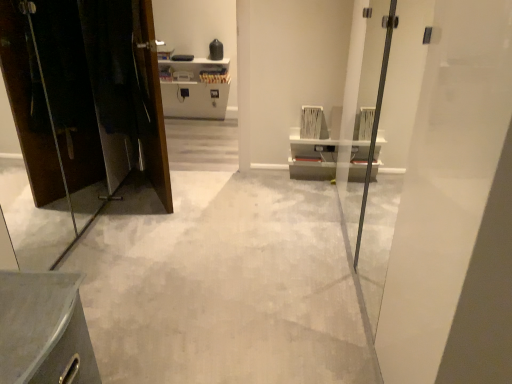
Question: Considering the relative sizes of metallic gray cabinet at lower left and matte black elevator at left in the image provided, is metallic gray cabinet at lower left smaller than matte black elevator at left?

Choices:
 (A) no
 (B) yes

Answer: (B)

Question: From the image's perspective, is metallic gray cabinet at lower left on top of matte black elevator at left?

Choices:
 (A) yes
 (B) no

Answer: (B)

Question: Can you confirm if metallic gray cabinet at lower left is wider than matte black elevator at left?

Choices:
 (A) no
 (B) yes

Answer: (B)

Question: Does metallic gray cabinet at lower left lie behind matte black elevator at left?

Choices:
 (A) no
 (B) yes

Answer: (A)

Question: Can you confirm if metallic gray cabinet at lower left is shorter than matte black elevator at left?

Choices:
 (A) yes
 (B) no

Answer: (A)

Question: Considering the relative sizes of metallic gray cabinet at lower left and matte black elevator at left in the image provided, is metallic gray cabinet at lower left bigger than matte black elevator at left?

Choices:
 (A) yes
 (B) no

Answer: (B)

Question: Is gray concrete floor at center not inside metallic gray cabinet at lower left?

Choices:
 (A) no
 (B) yes

Answer: (B)

Question: Could you tell me if gray concrete floor at center is facing metallic gray cabinet at lower left?

Choices:
 (A) no
 (B) yes

Answer: (A)

Question: Is metallic gray cabinet at lower left a part of gray concrete floor at center?

Choices:
 (A) yes
 (B) no

Answer: (B)

Question: From the image's perspective, is gray concrete floor at center on top of metallic gray cabinet at lower left?

Choices:
 (A) yes
 (B) no

Answer: (A)

Question: Considering the relative sizes of gray concrete floor at center and metallic gray cabinet at lower left in the image provided, is gray concrete floor at center thinner than metallic gray cabinet at lower left?

Choices:
 (A) no
 (B) yes

Answer: (A)

Question: Considering the relative sizes of gray concrete floor at center and metallic gray cabinet at lower left in the image provided, is gray concrete floor at center shorter than metallic gray cabinet at lower left?

Choices:
 (A) no
 (B) yes

Answer: (B)

Question: From a real-world perspective, is white glossy door at right located beneath matte black elevator at left?

Choices:
 (A) yes
 (B) no

Answer: (B)